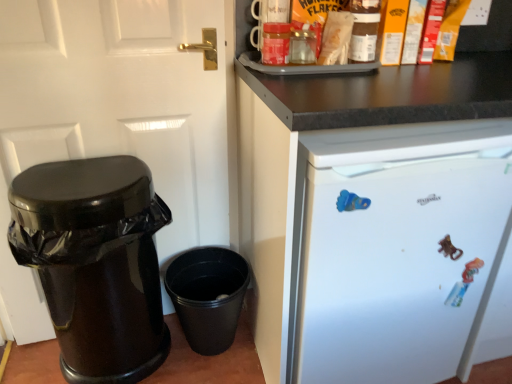
Question: Visually, is matte brown jar at upper center positioned to the left or to the right of white glossy door at left?

Choices:
 (A) left
 (B) right

Answer: (B)

Question: Does point (366, 57) appear closer or farther from the camera than point (4, 18)?

Choices:
 (A) farther
 (B) closer

Answer: (A)

Question: Which of these objects is positioned closest to the white matte refrigerator at upper right?

Choices:
 (A) black plastic bucket at lower center
 (B) white glossy door at left
 (C) glossy plastic trash can at left
 (D) matte brown jar at upper center

Answer: (D)

Question: Considering the real-world distances, which object is closest to the black plastic bucket at lower center?

Choices:
 (A) matte brown jar at upper center
 (B) white glossy door at left
 (C) white matte refrigerator at upper right
 (D) glossy plastic trash can at left

Answer: (D)